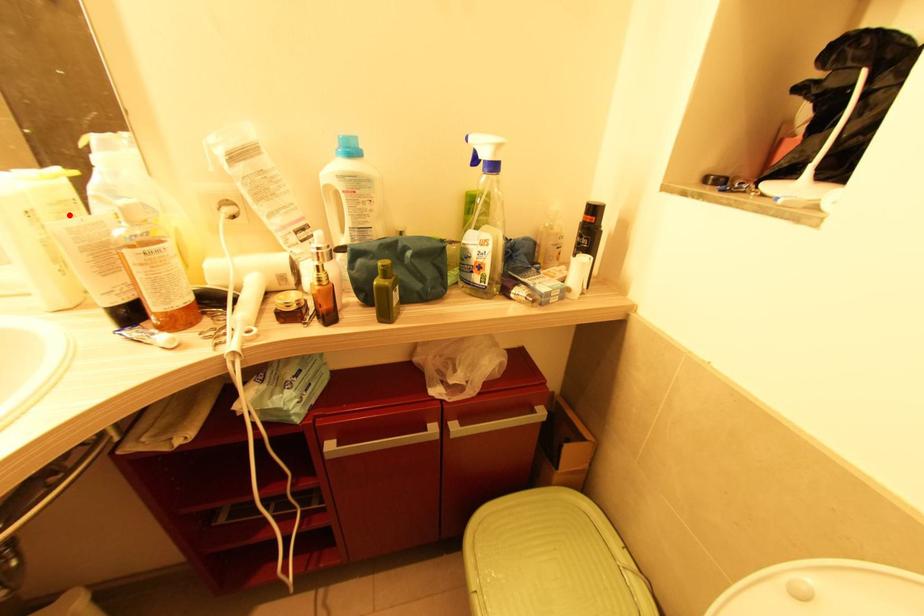
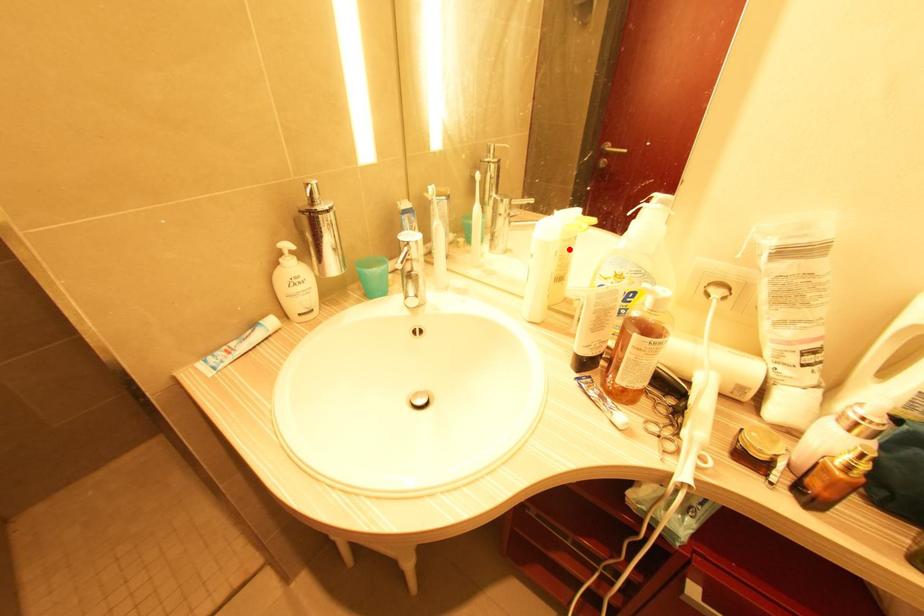
From the picture: I am providing you with two images of the same scene from different viewpoints. A red point is marked on the first image and another point is marked on the second image. Are the points marked in image1 and image2 representing the same 3D position?

Yes